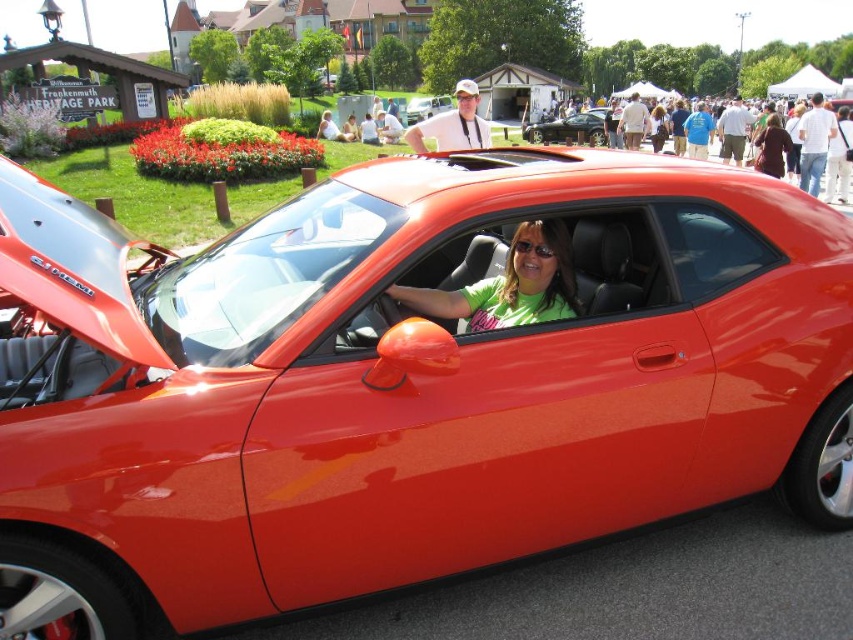
Question: Among these objects, which one is nearest to the camera?

Choices:
 (A) glossy orange car at center
 (B) matte brown jacket at center
 (C) matte white shirt at center

Answer: (C)

Question: Among these objects, which one is farthest from the camera?

Choices:
 (A) green matte shirt at center
 (B) matte white shirt at center
 (C) glossy orange car at center

Answer: (C)

Question: Can you confirm if matte white shirt at center is thinner than glossy orange car at center?

Choices:
 (A) no
 (B) yes

Answer: (B)

Question: Does green matte shirt at center appear under matte white shirt at center?

Choices:
 (A) yes
 (B) no

Answer: (A)

Question: Among these objects, which one is farthest from the camera?

Choices:
 (A) matte white shirt at center
 (B) glossy black car at center
 (C) glossy orange car at center

Answer: (C)

Question: Can you confirm if glossy black car at center is positioned below matte brown jacket at center?

Choices:
 (A) no
 (B) yes

Answer: (A)